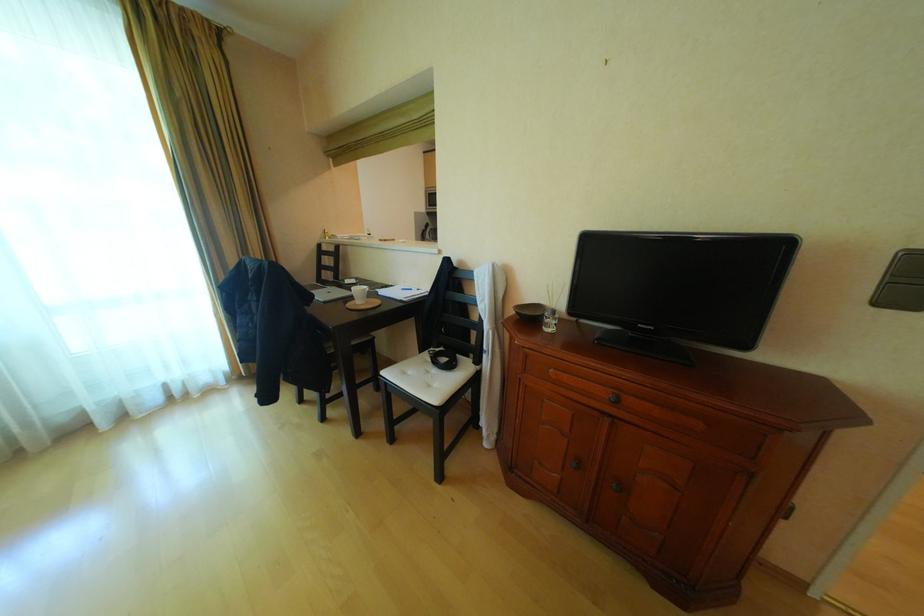
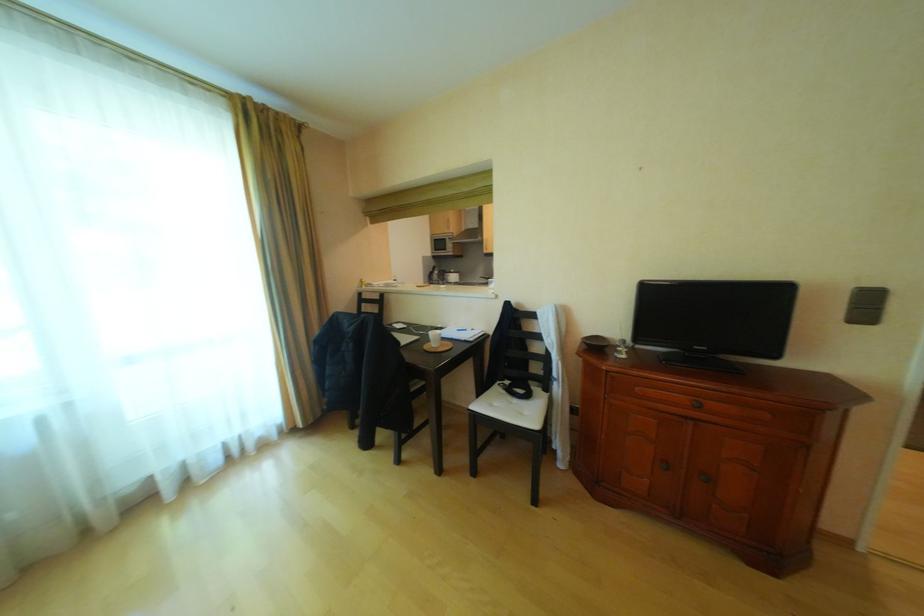
Question: How did the camera likely rotate?

Choices:
 (A) Left
 (B) Right
 (C) Up
 (D) Down

Answer: (C)